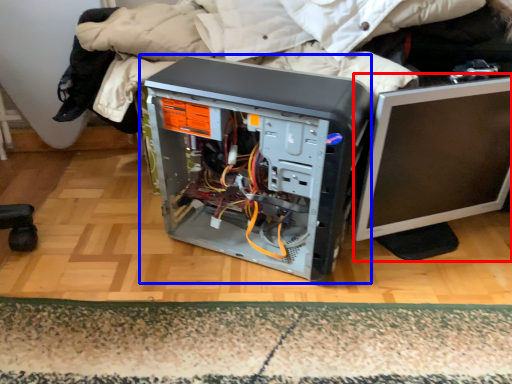
Question: Which point is closer to the camera, computer monitor (highlighted by a red box) or computer tower (highlighted by a blue box)?

Choices:
 (A) computer monitor
 (B) computer tower

Answer: (B)